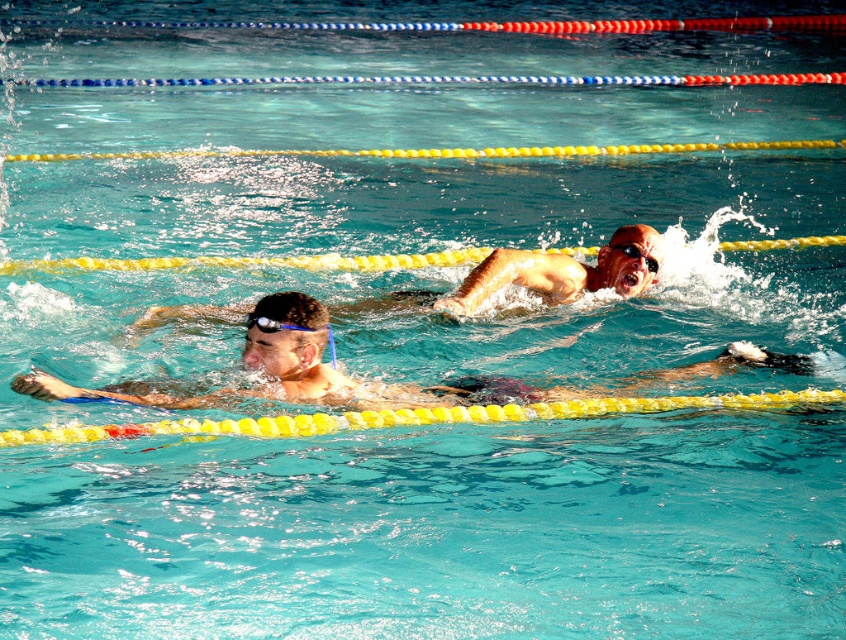
What do you see at coordinates (360, 380) in the screenshot? This screenshot has height=640, width=846. I see `smooth skin swimmer at center` at bounding box center [360, 380].

Is smooth skin swimmer at center thinner than black rubber goggles at center?

In fact, smooth skin swimmer at center might be wider than black rubber goggles at center.

Is point (237, 401) farther from viewer compared to point (649, 260)?

That is False.

Locate an element on the screen. This screenshot has height=640, width=846. smooth skin swimmer at center is located at coordinates (360, 380).

Is point (404, 396) positioned before point (165, 307)?

Yes, it is in front of point (165, 307).

Which is in front, point (467, 397) or point (537, 273)?

Point (467, 397) is in front.

Is point (481, 381) closer to camera compared to point (492, 284)?

That is True.

Where is `smooth skin swimmer at center`? smooth skin swimmer at center is located at coordinates (360, 380).

Between black matte swim cap at upper center and black rubber goggles at center, which one appears on the right side from the viewer's perspective?

Positioned to the right is black rubber goggles at center.

Is point (552, 253) positioned before point (652, 262)?

Yes, point (552, 253) is closer to viewer.

This screenshot has width=846, height=640. I want to click on black matte swim cap at upper center, so click(x=534, y=276).